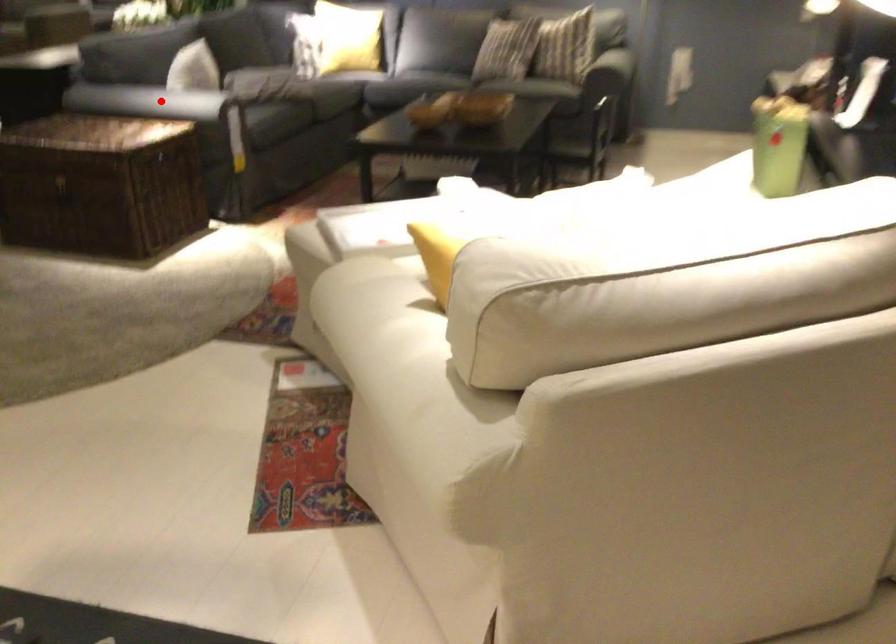
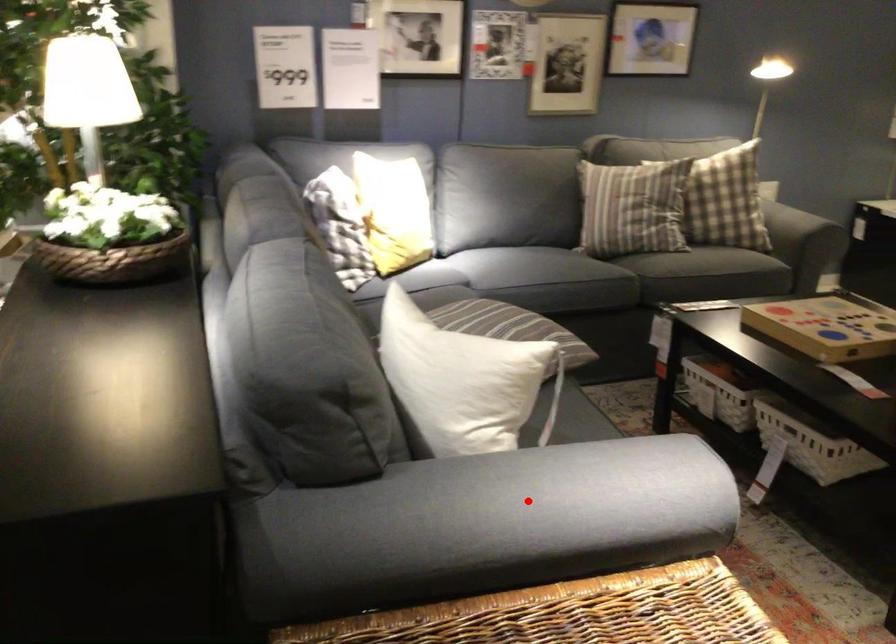
I am providing you with two images of the same scene from different viewpoints. A red point is marked on the first image and another point is marked on the second image. Is the marked point in image1 the same physical position as the marked point in image2?

Yes